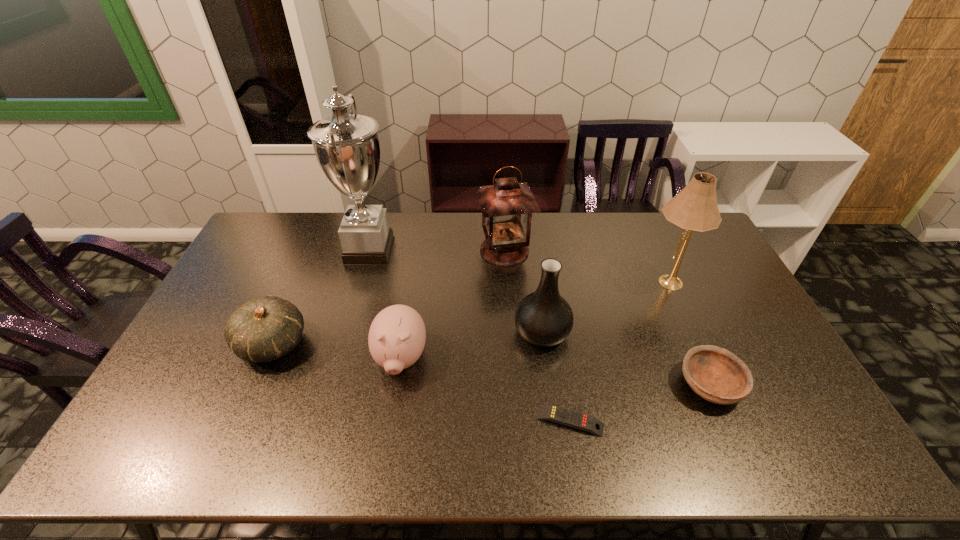
In order to click on lampshade positioned at the right edge in this screenshot , I will do `click(694, 208)`.

Locate an element on the screen. bowl that is at the right edge is located at coordinates (717, 375).

At what (x,y) coordinates should I click in order to perform the action: click on blank area at the far edge. Please return your answer as a coordinate pair (x, y). Looking at the image, I should click on (629, 219).

This screenshot has height=540, width=960. I want to click on blank space at the near edge of the desktop, so click(x=428, y=434).

The width and height of the screenshot is (960, 540). Identify the location of vacant space at the left edge of the desktop. (252, 284).

Where is `free point at the far right corner`? The width and height of the screenshot is (960, 540). free point at the far right corner is located at coordinates (668, 240).

Where is `free space at the near right corner of the desktop`? This screenshot has width=960, height=540. free space at the near right corner of the desktop is located at coordinates (828, 447).

Find the location of `free space between the second shortest object and the seventh shortest object`. free space between the second shortest object and the seventh shortest object is located at coordinates (687, 334).

Where is `vacant point located between the shortest object and the seventh shortest object`? vacant point located between the shortest object and the seventh shortest object is located at coordinates (617, 352).

Where is `empty space that is in between the shortest object and the fourth tallest object`? empty space that is in between the shortest object and the fourth tallest object is located at coordinates (556, 376).